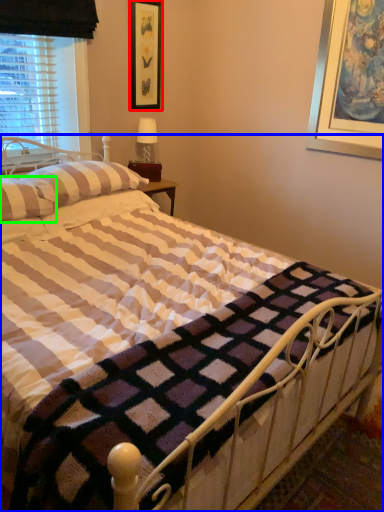
Question: Estimate the real-world distances between objects in this image. Which object is farther from picture frame (highlighted by a red box), bed (highlighted by a blue box) or pillow (highlighted by a green box)?

Choices:
 (A) bed
 (B) pillow

Answer: (A)